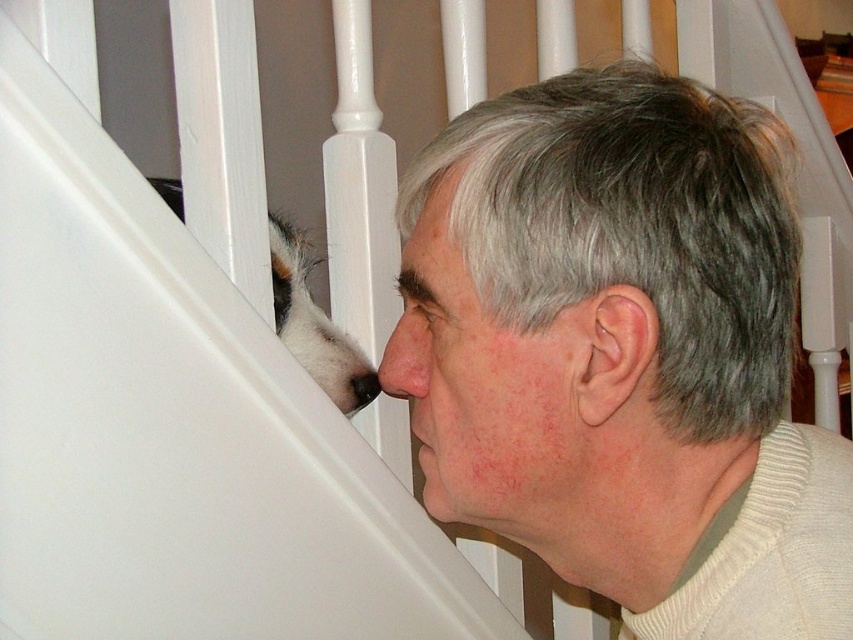
Question: Is white matte hair at upper center in front of matte white nose at center?

Choices:
 (A) no
 (B) yes

Answer: (B)

Question: In this image, where is white ribbed sweater at lower right located relative to matte white nose at center?

Choices:
 (A) right
 (B) left

Answer: (A)

Question: Can you confirm if white fur at lower left is positioned below matte white nose at center?

Choices:
 (A) no
 (B) yes

Answer: (A)

Question: Which of the following is the farthest from the observer?

Choices:
 (A) (850, 550)
 (B) (320, 372)
 (C) (404, 316)

Answer: (B)

Question: Which point is farther from the camera taking this photo?

Choices:
 (A) (415, 381)
 (B) (619, 637)
 (C) (315, 310)
 (D) (593, 285)

Answer: (C)

Question: Which point is closer to the camera?

Choices:
 (A) (399, 369)
 (B) (811, 632)
 (C) (636, 182)
 (D) (315, 332)

Answer: (B)